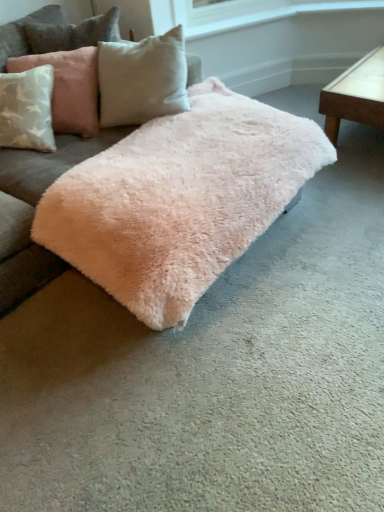
Question: Can you confirm if light pink plush pillow at upper left is positioned to the left of fuzzy pink rug at center?

Choices:
 (A) yes
 (B) no

Answer: (A)

Question: From the image's perspective, is light pink plush pillow at upper left on top of fuzzy pink rug at center?

Choices:
 (A) no
 (B) yes

Answer: (B)

Question: Is light pink plush pillow at upper left taller than fuzzy pink rug at center?

Choices:
 (A) no
 (B) yes

Answer: (A)

Question: From a real-world perspective, does light pink plush pillow at upper left sit lower than fuzzy pink rug at center?

Choices:
 (A) yes
 (B) no

Answer: (B)

Question: Are light pink plush pillow at upper left and fuzzy pink rug at center beside each other?

Choices:
 (A) yes
 (B) no

Answer: (B)

Question: Can you confirm if light pink plush pillow at upper left is shorter than fuzzy pink rug at center?

Choices:
 (A) yes
 (B) no

Answer: (A)

Question: Is light brown wooden table at right oriented towards light pink plush pillow at upper left?

Choices:
 (A) no
 (B) yes

Answer: (A)

Question: Does light brown wooden table at right have a larger size compared to light pink plush pillow at upper left?

Choices:
 (A) yes
 (B) no

Answer: (A)

Question: Can you confirm if light brown wooden table at right is positioned to the right of light pink plush pillow at upper left?

Choices:
 (A) no
 (B) yes

Answer: (B)

Question: Can you confirm if light brown wooden table at right is shorter than light pink plush pillow at upper left?

Choices:
 (A) yes
 (B) no

Answer: (A)

Question: Considering the relative sizes of light brown wooden table at right and light pink plush pillow at upper left in the image provided, is light brown wooden table at right thinner than light pink plush pillow at upper left?

Choices:
 (A) no
 (B) yes

Answer: (A)

Question: From the image's perspective, is light brown wooden table at right below light pink plush pillow at upper left?

Choices:
 (A) yes
 (B) no

Answer: (B)

Question: Does fuzzy pink rug at center turn towards light brown wooden table at right?

Choices:
 (A) no
 (B) yes

Answer: (A)